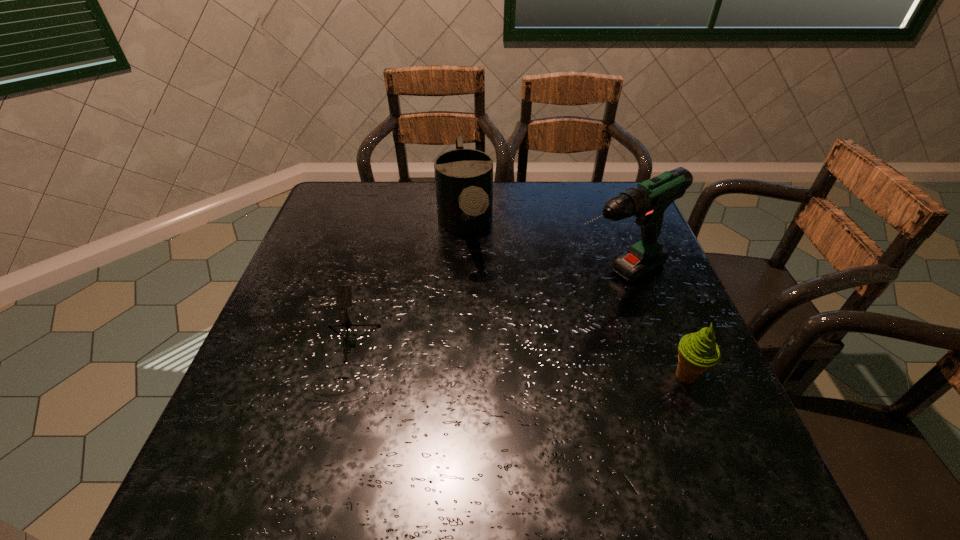
Locate an element on the screen. empty space that is in between the leftmost object and the second tallest object is located at coordinates (404, 293).

The width and height of the screenshot is (960, 540). What are the coordinates of `free point between the drill and the icecream` in the screenshot? It's located at (651, 327).

Find the location of a particular element. This screenshot has height=540, width=960. vacant space that is in between the third shortest object and the leftmost object is located at coordinates (404, 293).

Identify the location of free point between the third shortest object and the icecream. The image size is (960, 540). (575, 301).

Identify the location of free point between the drill and the shortest object. (480, 319).

Image resolution: width=960 pixels, height=540 pixels. What are the coordinates of `free space between the drill and the shortest object` in the screenshot? It's located at (480, 319).

Find the location of a particular element. unoccupied area between the drill and the leftmost object is located at coordinates (480, 319).

Point out which object is positioned as the third nearest to the icecream. Please provide its 2D coordinates. Your answer should be formatted as a tuple, i.e. [(x, y)], where the tuple contains the x and y coordinates of a point satisfying the conditions above.

[(344, 292)]

The width and height of the screenshot is (960, 540). I want to click on object that stands as the second closest to the shortest object, so click(647, 201).

Identify the location of free location that satisfies the following two spatial constraints: 1. on the stand of the icecream; 2. on the right side of the shortest object. This screenshot has height=540, width=960. (339, 376).